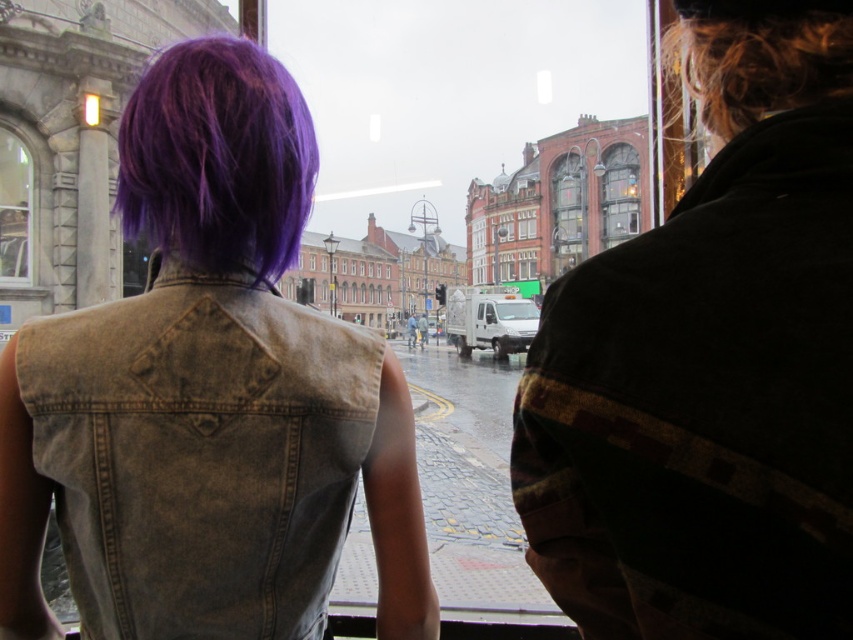
You are a passenger in a car and want to check the weather outside. You notice the purple hair at upper left and the glassy brown window at center. Which object is closer to the left side of the car?

The purple hair at upper left is positioned on the left side of the glassy brown window at center, so it is closer to the left side of the car.

In the scene shown: You are inside a vehicle and want to know how far the point at coordinates [288,204] is from your current position. Can you determine the distance?

The point at coordinates [288,204] is 39.82 meters away from your current position in the vehicle.